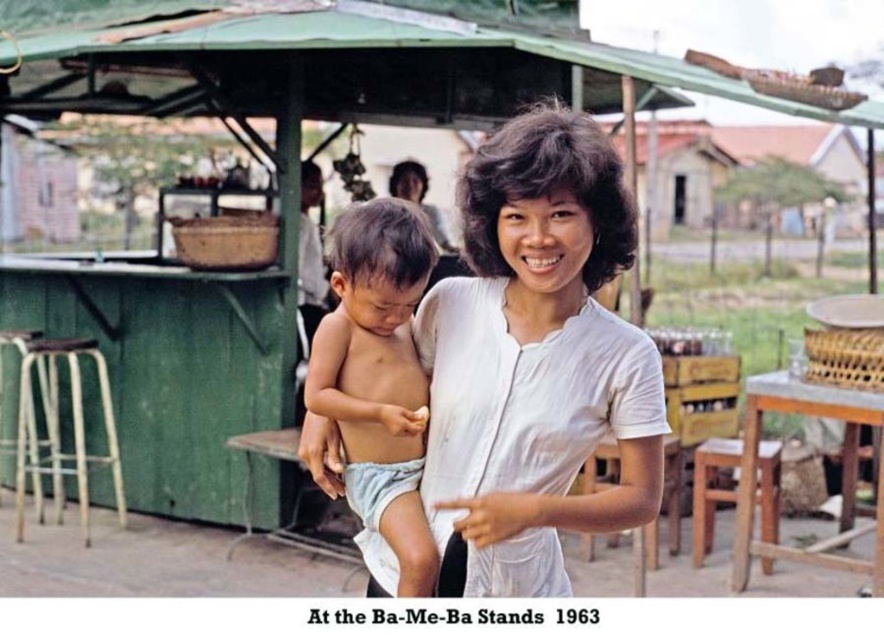
Describe the element at coordinates (535, 362) in the screenshot. I see `white cotton shirt at center` at that location.

Is white cotton shirt at center smaller than wooden stool at lower right?

No.

The height and width of the screenshot is (640, 884). Describe the element at coordinates (535, 362) in the screenshot. I see `white cotton shirt at center` at that location.

Where is `white cotton shirt at center`? The image size is (884, 640). white cotton shirt at center is located at coordinates (535, 362).

Does white cotton shirt at center appear on the right side of light brown skin/soft skin"object at center?

Indeed, white cotton shirt at center is positioned on the right side of light brown skin/soft skin"object at center.

Who is positioned more to the left, white cotton shirt at center or light brown skin/soft skin"object at center?

Positioned to the left is light brown skin/soft skin"object at center.

Which is in front, point (546, 244) or point (341, 212)?

Point (546, 244) is more forward.

Find the location of `white cotton shirt at center`. white cotton shirt at center is located at coordinates (535, 362).

Is the position of green fabric canopy at upper center less distant than that of metallic silver stool at left?

Yes, it is in front of metallic silver stool at left.

Does green fabric canopy at upper center appear over metallic silver stool at left?

Yes.

Is point (245, 20) in front of point (112, 454)?

That is True.

I want to click on green fabric canopy at upper center, so click(339, 58).